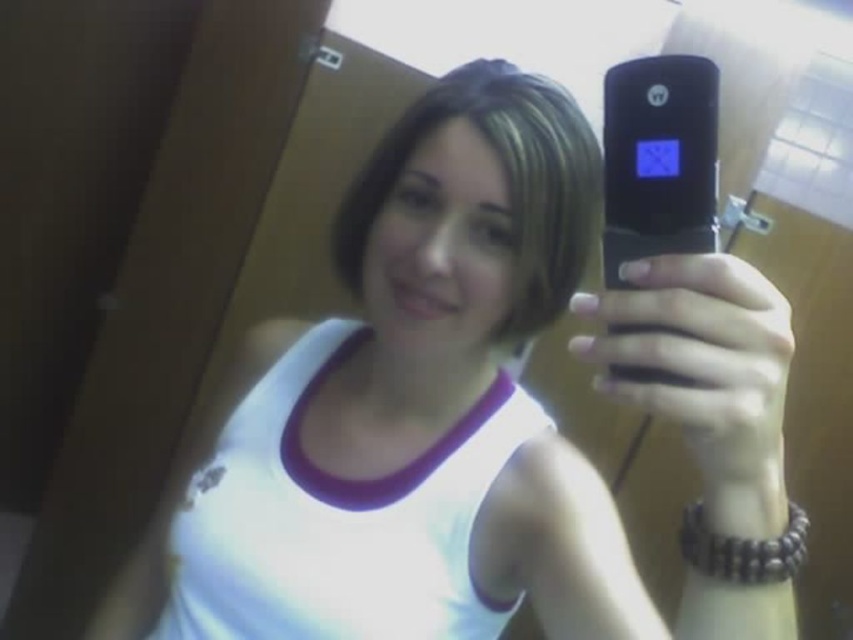
Question: Considering the relative positions of matte black phone at center and black matte smartphone at center in the image provided, where is matte black phone at center located with respect to black matte smartphone at center?

Choices:
 (A) right
 (B) left

Answer: (A)

Question: Among these objects, which one is nearest to the camera?

Choices:
 (A) black matte smartphone at center
 (B) matte black phone at center

Answer: (B)

Question: Can you confirm if matte black phone at center is positioned to the left of black matte smartphone at center?

Choices:
 (A) yes
 (B) no

Answer: (B)

Question: Can you confirm if matte black phone at center is positioned to the right of black matte smartphone at center?

Choices:
 (A) yes
 (B) no

Answer: (A)

Question: Among these objects, which one is nearest to the camera?

Choices:
 (A) black matte smartphone at center
 (B) matte black phone at center

Answer: (B)